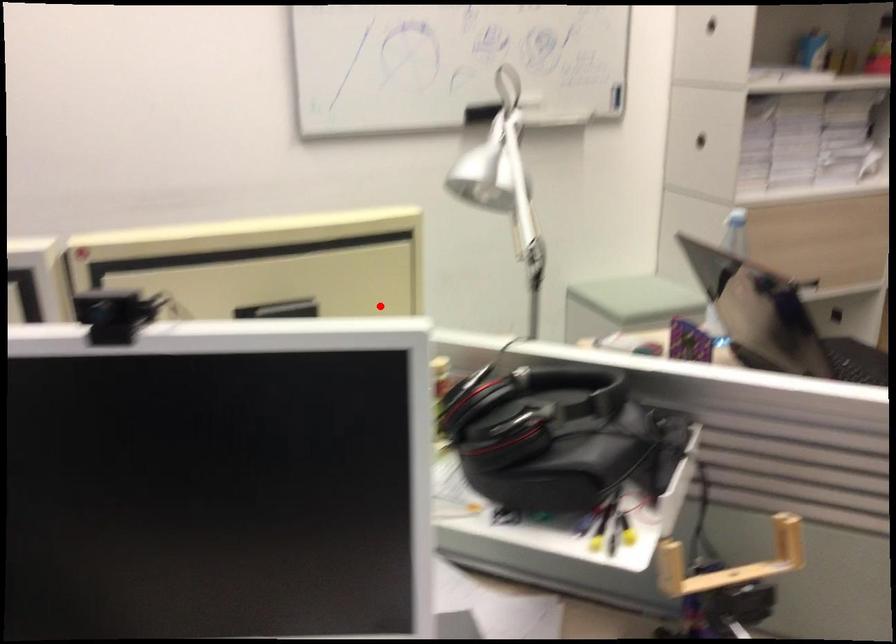
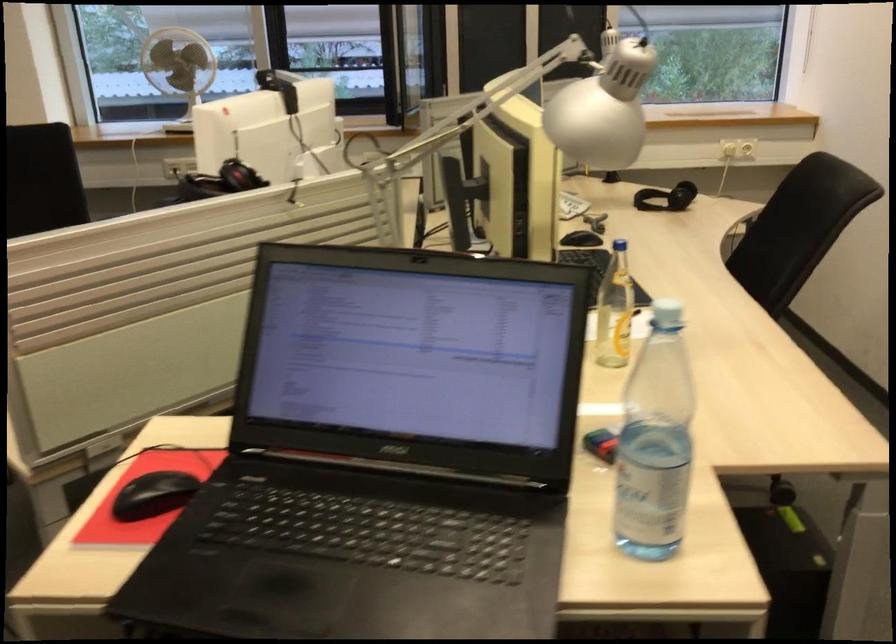
Find the pixel in the second image that matches the highlighted location in the first image.

(618, 245)